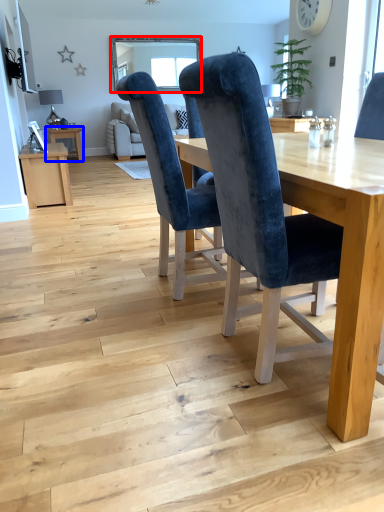
Question: Which point is further to the camera, window screen (highlighted by a red box) or table (highlighted by a blue box)?

Choices:
 (A) window screen
 (B) table

Answer: (A)